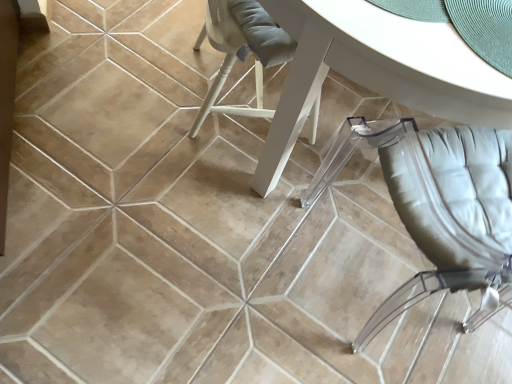
Question: Based on their sizes in the image, would you say white glossy table at center is bigger or smaller than transparent leather chair at lower right?

Choices:
 (A) big
 (B) small

Answer: (A)

Question: Is white glossy table at center to the left or to the right of transparent leather chair at lower right in the image?

Choices:
 (A) left
 (B) right

Answer: (A)

Question: In the image, is white glossy table at center positioned in front of or behind transparent leather chair at lower right?

Choices:
 (A) front
 (B) behind

Answer: (B)

Question: Does point (495, 152) appear closer or farther from the camera than point (230, 29)?

Choices:
 (A) closer
 (B) farther

Answer: (A)

Question: Is transparent leather chair at lower right situated inside white glossy table at center or outside?

Choices:
 (A) outside
 (B) inside

Answer: (A)

Question: Is transparent leather chair at lower right bigger or smaller than white glossy table at center?

Choices:
 (A) big
 (B) small

Answer: (B)

Question: Is transparent leather chair at lower right in front of or behind white glossy table at center in the image?

Choices:
 (A) behind
 (B) front

Answer: (B)